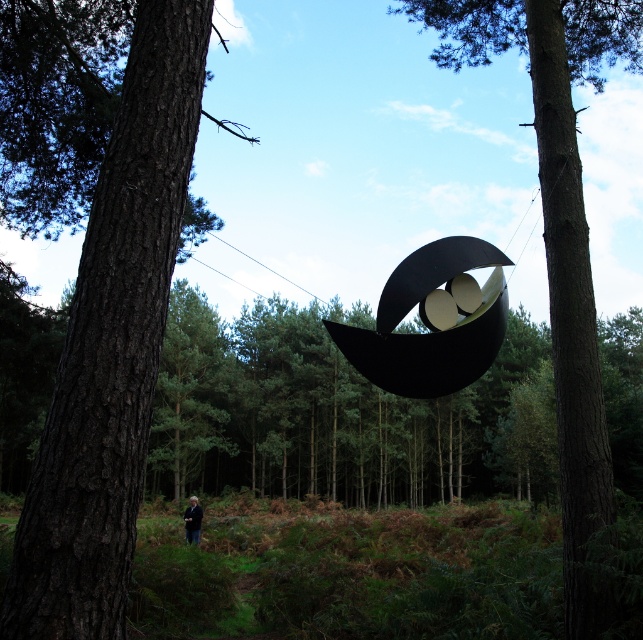
Question: Which of the following is the closest to the observer?

Choices:
 (A) (574, 396)
 (B) (185, 529)
 (C) (107, 289)

Answer: (C)

Question: Estimate the real-world distances between objects in this image. Which object is closer to the black fabric person at lower center?

Choices:
 (A) dark brown textured tree trunk at left
 (B) smooth brown tree trunk at center

Answer: (A)

Question: In this image, where is smooth brown tree trunk at center located relative to black fabric person at lower center?

Choices:
 (A) left
 (B) right

Answer: (B)

Question: Is dark brown textured tree trunk at left thinner than smooth brown tree trunk at center?

Choices:
 (A) yes
 (B) no

Answer: (B)

Question: Which point is farther to the camera?

Choices:
 (A) dark brown textured tree trunk at left
 (B) smooth brown tree trunk at center

Answer: (B)

Question: Does dark brown textured tree trunk at left come in front of black fabric person at lower center?

Choices:
 (A) yes
 (B) no

Answer: (A)